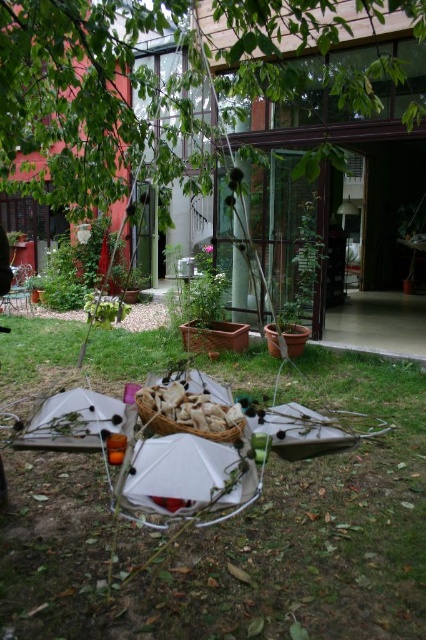
Between green leafy tree at upper center and white paper bag at center, which one is positioned higher?

Positioned higher is green leafy tree at upper center.

Who is positioned more to the right, green leafy tree at upper center or white paper bag at center?

A: From the viewer's perspective, white paper bag at center appears more on the right side.

Find the location of a particular element. The height and width of the screenshot is (640, 426). green leafy tree at upper center is located at coordinates (155, 81).

Between point (161, 628) and point (238, 422), which one is positioned behind?

The point (238, 422) is behind.

Can you confirm if green grass at center is wider than white paper bag at center?

Correct, the width of green grass at center exceeds that of white paper bag at center.

Locate an element on the screen. Image resolution: width=426 pixels, height=640 pixels. green grass at center is located at coordinates (241, 538).

Identify the location of green grass at center. (241, 538).

Does green grass at center have a smaller size compared to green leafy tree at upper center?

Yes.

Is green grass at center to the right of green leafy tree at upper center from the viewer's perspective?

Correct, you'll find green grass at center to the right of green leafy tree at upper center.

In order to click on green grass at center in this screenshot , I will do 241,538.